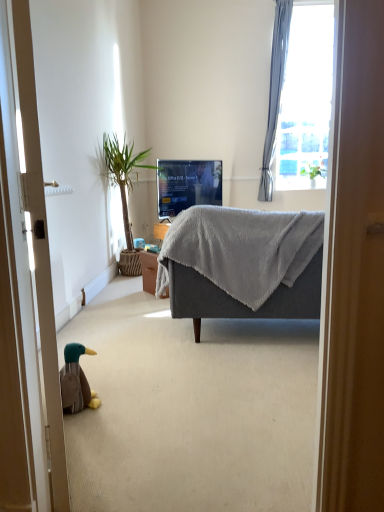
The image size is (384, 512). What do you see at coordinates (187, 185) in the screenshot?
I see `matte black tv at center` at bounding box center [187, 185].

What is the approximate height of green leafy plant at left?

1.39 meters.

This screenshot has width=384, height=512. In order to click on matte black tv at center in this screenshot , I will do `click(187, 185)`.

Considering their positions, is light blue sheer curtain at upper right located in front of or behind brown plush duck at lower left?

light blue sheer curtain at upper right is behind brown plush duck at lower left.

Is light blue sheer curtain at upper right positioned beyond the bounds of brown plush duck at lower left?

light blue sheer curtain at upper right lies outside brown plush duck at lower left's area.

How different are the orientations of light blue sheer curtain at upper right and brown plush duck at lower left in degrees?

There is a 114-degree angle between the facing directions of light blue sheer curtain at upper right and brown plush duck at lower left.

The width and height of the screenshot is (384, 512). Find the location of `plant above the wooden door at left (from a real-world perspective)`. plant above the wooden door at left (from a real-world perspective) is located at coordinates (313, 170).

Can wooden door at left be found inside green leafy plant at upper right?

No, green leafy plant at upper right does not contain wooden door at left.

Considering the sizes of green leafy plant at upper right and wooden door at left in the image, is green leafy plant at upper right bigger or smaller than wooden door at left?

green leafy plant at upper right is smaller than wooden door at left.

In the scene shown: Which object is thinner, green leafy plant at upper right or brown plush duck at lower left?

Thinner between the two is brown plush duck at lower left.

Based on their positions, is green leafy plant at upper right located to the left or right of brown plush duck at lower left?

green leafy plant at upper right is to the right of brown plush duck at lower left.

Does point (311, 165) appear closer or farther from the camera than point (67, 409)?

Point (311, 165) appears to be farther away from the viewer than point (67, 409).

Is green leafy plant at upper right with brown plush duck at lower left?

green leafy plant at upper right and brown plush duck at lower left are not in contact.

From a real-world perspective, is matte black tv at center on wooden door at left?

No, from a real-world perspective, matte black tv at center is not over wooden door at left

Is matte black tv at center bigger or smaller than wooden door at left?

Considering their sizes, matte black tv at center takes up more space than wooden door at left.

How different are the orientations of matte black tv at center and wooden door at left in degrees?

There is a 64-degree angle between the facing directions of matte black tv at center and wooden door at left.

From the image's perspective, is matte black tv at center above or below wooden door at left?

Clearly, from the image's perspective, matte black tv at center is above wooden door at left.

How many degrees apart are the facing directions of brown plush duck at lower left and green leafy plant at left?

The angular difference between brown plush duck at lower left and green leafy plant at left is 24.4 degrees.

Is brown plush duck at lower left taller than green leafy plant at left?

In fact, brown plush duck at lower left may be shorter than green leafy plant at left.

Is brown plush duck at lower left positioned behind green leafy plant at left?

No.

Considering the sizes of brown plush duck at lower left and green leafy plant at left in the image, is brown plush duck at lower left wider or thinner than green leafy plant at left?

Clearly, brown plush duck at lower left has less width compared to green leafy plant at left.

Which of these two, wooden door at left or green leafy plant at left, is bigger?

green leafy plant at left is bigger.

From a real-world perspective, which object rests below the other?

green leafy plant at left.

Is wooden door at left next to green leafy plant at left?

No, wooden door at left is not beside green leafy plant at left.

From the image's perspective, is matte black tv at center located above or below light blue sheer curtain at upper right?

matte black tv at center is situated lower than light blue sheer curtain at upper right in the image.

This screenshot has width=384, height=512. I want to click on television that appears on the left of light blue sheer curtain at upper right, so click(187, 185).

Is matte black tv at center next to light blue sheer curtain at upper right and touching it?

No, matte black tv at center is not in contact with light blue sheer curtain at upper right.

Relative to light blue sheer curtain at upper right, is matte black tv at center in front or behind?

matte black tv at center is positioned closer to the viewer than light blue sheer curtain at upper right.

I want to click on animal that is below the light blue sheer curtain at upper right (from the image's perspective), so click(x=76, y=381).

The width and height of the screenshot is (384, 512). Find the location of `door on the left of green leafy plant at upper right`. door on the left of green leafy plant at upper right is located at coordinates (24, 305).

Which object lies further to the anchor point brown plush duck at lower left, gray soft fabric couch at center or light blue sheer curtain at upper right?

light blue sheer curtain at upper right lies further to brown plush duck at lower left than the other object.

From the image, which object appears to be nearer to wooden door at left, gray soft fabric couch at center or matte black tv at center?

gray soft fabric couch at center.

From the image, which object appears to be farther from green leafy plant at left, matte black tv at center or brown plush duck at lower left?

brown plush duck at lower left.

Considering their positions, is wooden door at left positioned further to gray soft fabric couch at center than brown plush duck at lower left?

The object further to gray soft fabric couch at center is wooden door at left.

From the image, which object appears to be farther from green leafy plant at upper right, light blue sheer curtain at upper right or gray soft fabric couch at center?

Answer: Among the two, gray soft fabric couch at center is located further to green leafy plant at upper right.

Which object lies further to the anchor point green leafy plant at left, matte black tv at center or gray soft fabric couch at center?

gray soft fabric couch at center is positioned further to the anchor green leafy plant at left.

When comparing their distances from gray soft fabric couch at center, does light blue sheer curtain at upper right or matte black tv at center seem further?

Among the two, light blue sheer curtain at upper right is located further to gray soft fabric couch at center.

Which object lies further to the anchor point green leafy plant at upper right, gray soft fabric couch at center or wooden door at left?

Based on the image, wooden door at left appears to be further to green leafy plant at upper right.

The image size is (384, 512). In order to click on television between gray soft fabric couch at center and light blue sheer curtain at upper right from front to back in this screenshot , I will do `click(187, 185)`.

Where is `houseplant positioned between wooden door at left and green leafy plant at upper right from near to far`? This screenshot has height=512, width=384. houseplant positioned between wooden door at left and green leafy plant at upper right from near to far is located at coordinates (124, 190).

Find the location of a particular element. This screenshot has height=512, width=384. houseplant located between brown plush duck at lower left and green leafy plant at upper right in the depth direction is located at coordinates (124, 190).

I want to click on studio couch between brown plush duck at lower left and green leafy plant at upper right along the z-axis, so click(242, 264).